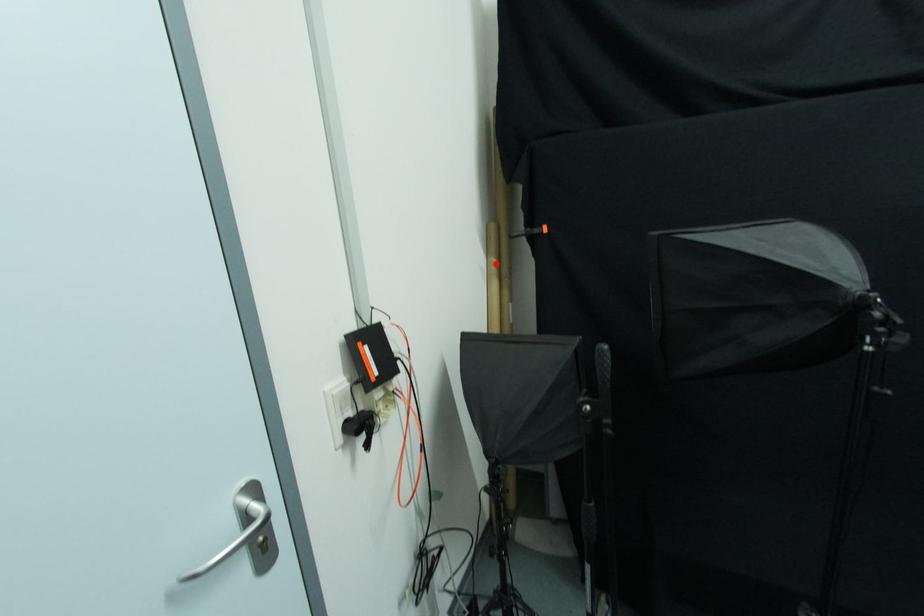
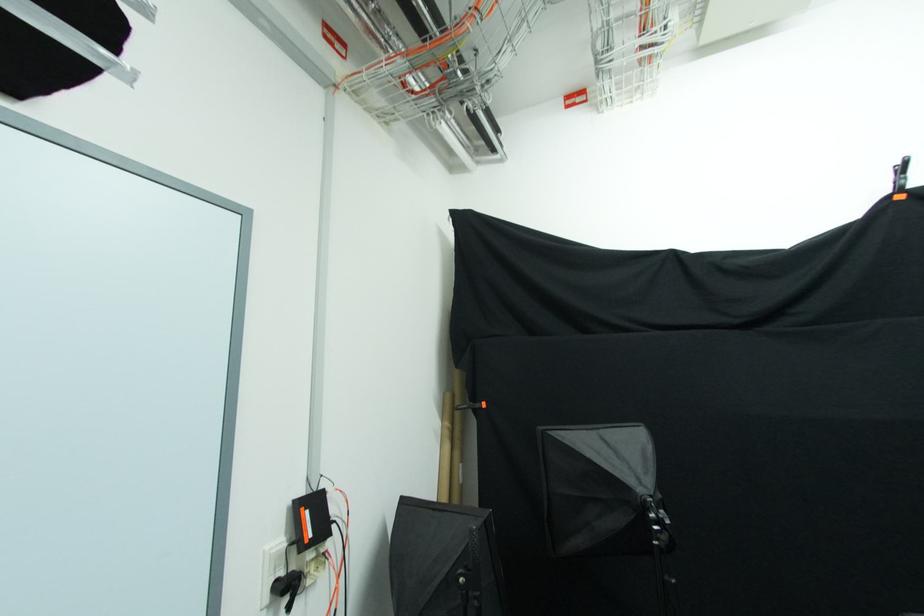
Question: I am providing you with two images of the same scene from different viewpoints. In image1, a red point is highlighted. Considering the same 3D point in image2, which of the following is correct?

Choices:
 (A) It is closer
 (B) It is farther

Answer: (B)